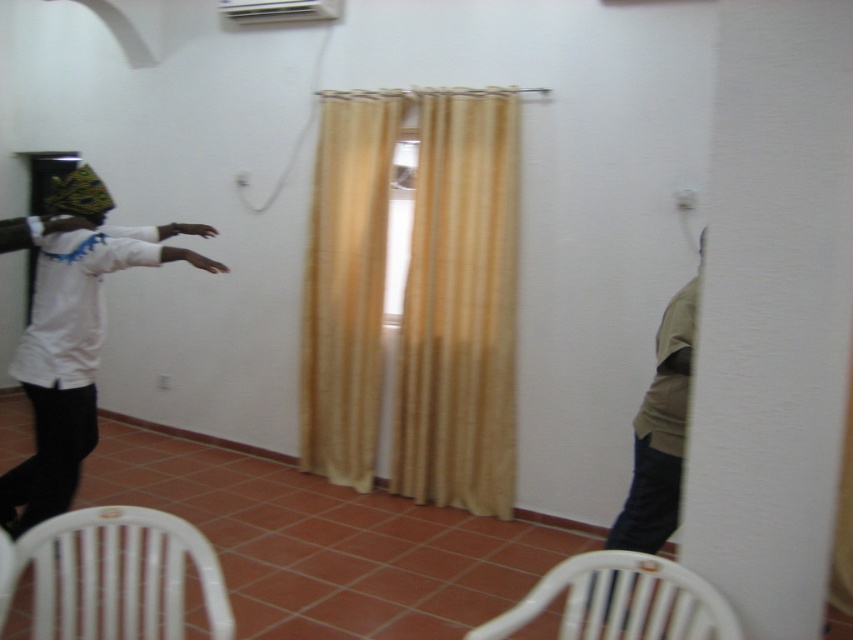
You are standing in the room and want to reach the khaki fabric shirt at right and the white plastic air conditioner at upper center. Which object is closer to the floor?

The khaki fabric shirt at right is closer to the floor because it is located below the white plastic air conditioner at upper center.

Based on the photo, you are a photographer setting up a shoot in this room. You want to place a tripod between the white matte shirt at left and the white plastic chair at lower left. Is the space between them sufficient to fit the tripod?

The white plastic chair at lower left is behind the white matte shirt at left, so there is no space between them for the tripod.